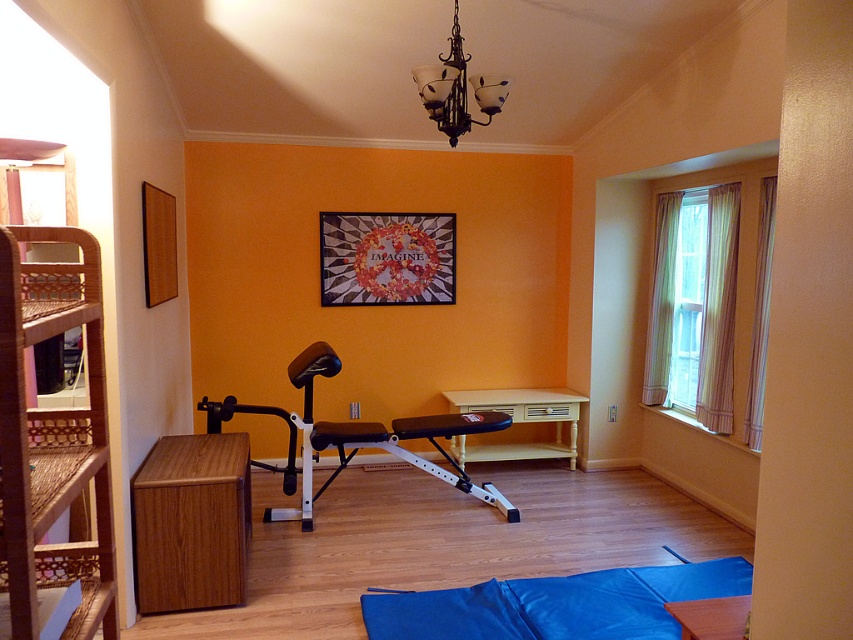
Question: Is wooden cabinet at left thinner than white plastic bench at center?

Choices:
 (A) no
 (B) yes

Answer: (B)

Question: Which point is closer to the camera taking this photo?

Choices:
 (A) 421,616
 (B) 35,497

Answer: (B)

Question: Is woven wood bunk bed at left bigger than blue fabric yoga mat at lower center?

Choices:
 (A) no
 (B) yes

Answer: (B)

Question: Estimate the real-world distances between objects in this image. Which object is farther from the blue fabric yoga mat at lower center?

Choices:
 (A) woven wood bunk bed at left
 (B) wooden cabinet at left
 (C) bronze glass chandelier at upper center

Answer: (C)

Question: Which point is farther from the camera taking this photo?

Choices:
 (A) (186, 458)
 (B) (460, 470)

Answer: (B)

Question: Does wooden cabinet at left appear on the left side of bronze glass chandelier at upper center?

Choices:
 (A) yes
 (B) no

Answer: (A)